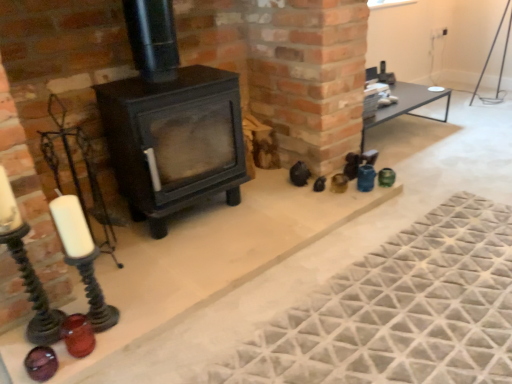
You are a GUI agent. You are given a task and a screenshot of the screen. Output one action in this format:
    pyautogui.click(x=<x>, y=<y>)
    Task: Click on the vacant area located to the right-hand side of translucent amber glass candle holder at lower left
    
    Given the screenshot: What is the action you would take?
    pyautogui.click(x=126, y=328)